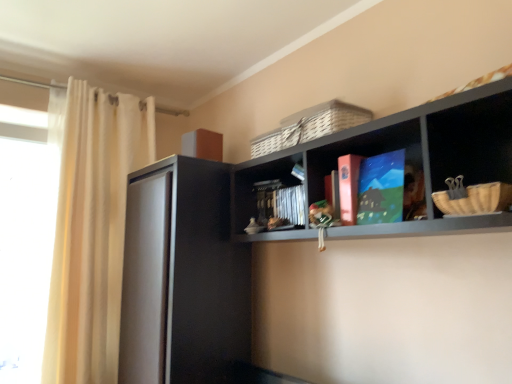
Question: Is matte cardboard book at center, placed as the 2th book when sorted from back to front, situated inside matte blue book at center, marked as the 1th book in a front-to-back arrangement, or outside?

Choices:
 (A) inside
 (B) outside

Answer: (B)

Question: Relative to matte blue book at center, marked as the 1th book in a front-to-back arrangement, is matte cardboard book at center, placed as the 2th book when sorted from back to front, in front or behind?

Choices:
 (A) behind
 (B) front

Answer: (A)

Question: Estimate the real-world distances between objects in this image. Which object is closer to the matte black book at center, which ranks as the third book in front-to-back order?

Choices:
 (A) woven straw basket at right, the second basket positioned from the top
 (B) black matte cabinet at left
 (C) matte blue book at center, which is the third book from back to front
 (D) transparent glass window at left
 (E) matte cardboard book at center, the second book in the front-to-back sequence

Answer: (E)

Question: Which of these objects is positioned closest to the transparent glass window at left?

Choices:
 (A) woven wicker basket at upper center, which is the 2th basket in right-to-left order
 (B) matte blue book at center, which is the third book from back to front
 (C) white sheer curtain at left
 (D) black matte cabinet at left
 (E) matte black book at center, arranged as the first book when viewed from the back

Answer: (C)